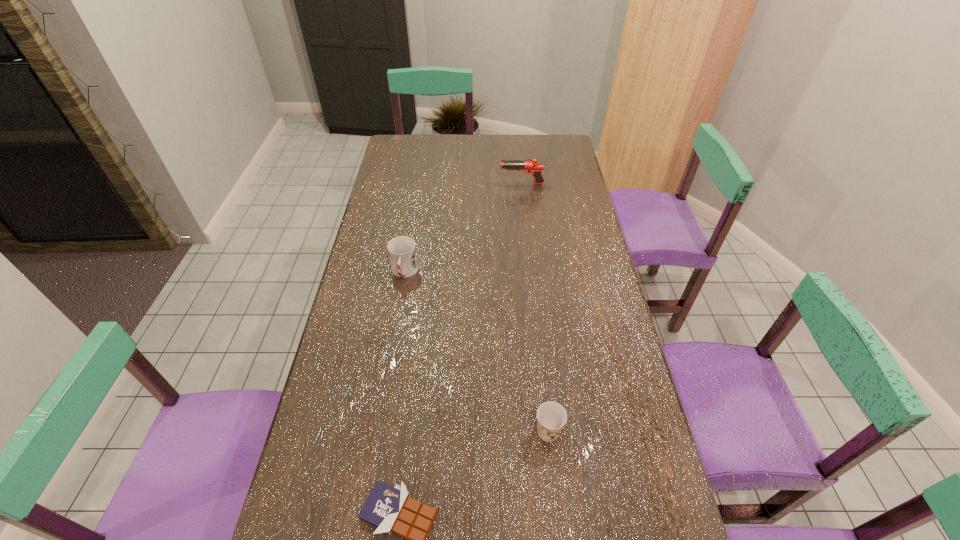
Identify the location of object that is the third closest to the cup. The image size is (960, 540). (389, 508).

Locate an element on the screen. the second closest object to the gun is located at coordinates (551, 417).

This screenshot has height=540, width=960. I want to click on vacant position in the image that satisfies the following two spatial constraints: 1. at the aiming end of the gun; 2. on the handle side of the cup, so click(532, 272).

I want to click on vacant region that satisfies the following two spatial constraints: 1. at the aiming end of the farthest object; 2. on the handle side of the cup, so [532, 272].

Find the location of `free space that satisfies the following two spatial constraints: 1. on the handle side of the third farthest object; 2. on the left side of the cup`. free space that satisfies the following two spatial constraints: 1. on the handle side of the third farthest object; 2. on the left side of the cup is located at coordinates (378, 431).

Find the location of a particular element. This screenshot has height=540, width=960. free spot that satisfies the following two spatial constraints: 1. at the aiming end of the gun; 2. on the handle side of the third nearest object is located at coordinates (532, 272).

In order to click on vacant region that satisfies the following two spatial constraints: 1. on the handle side of the second farthest object; 2. on the left side of the Dixie cup in this screenshot , I will do coord(378,431).

You are a GUI agent. You are given a task and a screenshot of the screen. Output one action in this format:
    pyautogui.click(x=<x>, y=<y>)
    Task: Click on the vacant space that satisfies the following two spatial constraints: 1. at the aiming end of the gun; 2. on the handle side of the cup
    The height and width of the screenshot is (540, 960).
    Given the screenshot: What is the action you would take?
    pyautogui.click(x=532, y=272)